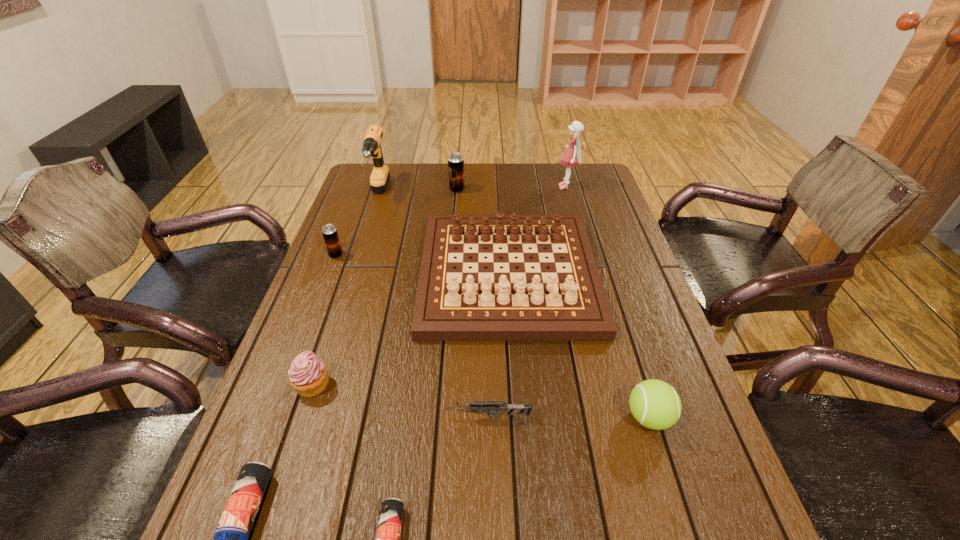
At what (x,y) coordinates should I click in order to perform the action: click on vacant region located 0.160m aimed along the barrel of the grey gun. Please return your answer as a coordinate pair (x, y). Image resolution: width=960 pixels, height=540 pixels. Looking at the image, I should click on (369, 416).

At what (x,y) coordinates should I click in order to perform the action: click on vacant region located 0.260m aimed along the barrel of the grey gun. Please return your answer as a coordinate pair (x, y). Looking at the image, I should click on pyautogui.click(x=320, y=416).

Locate an element on the screen. doll that is at the far edge is located at coordinates (572, 155).

The height and width of the screenshot is (540, 960). Identify the location of drill that is at the far edge. (380, 175).

Locate an element on the screen. The width and height of the screenshot is (960, 540). beer can situated at the far edge is located at coordinates (455, 160).

At what (x,y) coordinates should I click in order to perform the action: click on drill that is at the left edge. Please return your answer as a coordinate pair (x, y). Looking at the image, I should click on pyautogui.click(x=380, y=175).

I want to click on beer can situated at the left edge, so click(x=329, y=231).

Image resolution: width=960 pixels, height=540 pixels. In order to click on cupcake situated at the left edge in this screenshot , I will do `click(308, 375)`.

Identify the location of doll located at the right edge. Image resolution: width=960 pixels, height=540 pixels. (572, 155).

At what (x,y) coordinates should I click in order to perform the action: click on gameboard that is at the right edge. Please return your answer as a coordinate pair (x, y). The height and width of the screenshot is (540, 960). Looking at the image, I should click on (462, 299).